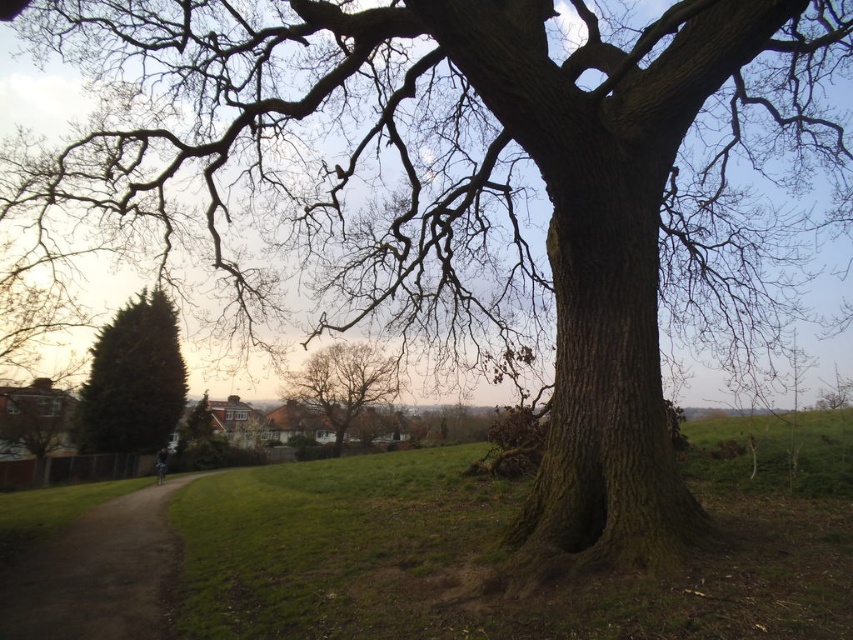
Question: Which of the following is the farthest from the observer?

Choices:
 (A) bare branches at center
 (B) dirt path at lower left
 (C) green textured hedge at left

Answer: (C)

Question: Which of these objects is positioned farthest from the bare branches at center?

Choices:
 (A) dirt path at lower left
 (B) green textured hedge at left

Answer: (B)

Question: Is dirt path at lower left smaller than bare branches at center?

Choices:
 (A) yes
 (B) no

Answer: (A)

Question: Does green textured hedge at left have a lesser width compared to bare branches at center?

Choices:
 (A) no
 (B) yes

Answer: (B)

Question: Which object appears closest to the camera in this image?

Choices:
 (A) green textured hedge at left
 (B) bare branches at center
 (C) dirt path at lower left

Answer: (C)

Question: Does dirt path at lower left appear under green textured hedge at left?

Choices:
 (A) no
 (B) yes

Answer: (B)